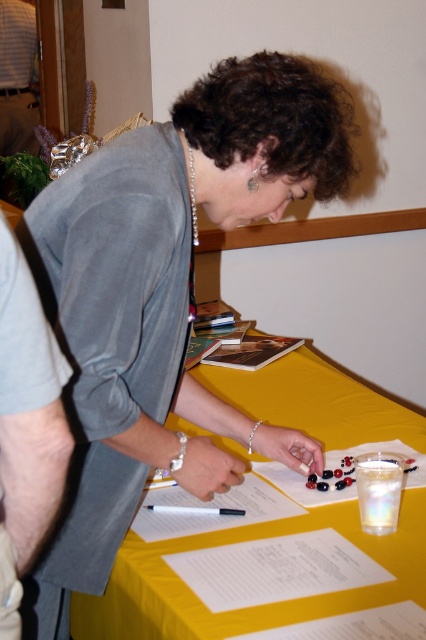
You are a delivery person who needs to place a package between the gray fabric shirt at left and the brushed metal water at bottle left. The package is 3 meters long. Will it fit between them?

The distance between the gray fabric shirt at left and the brushed metal water at bottle left is 3.35 meters, so the 3 meter package will fit between them since it is shorter than the available space.

You need to place a new object on the yellow fabric table at center and the black plastic pen at center. Which object requires more space due to its size?

The yellow fabric table at center requires more space due to its larger size compared to the black plastic pen at center.